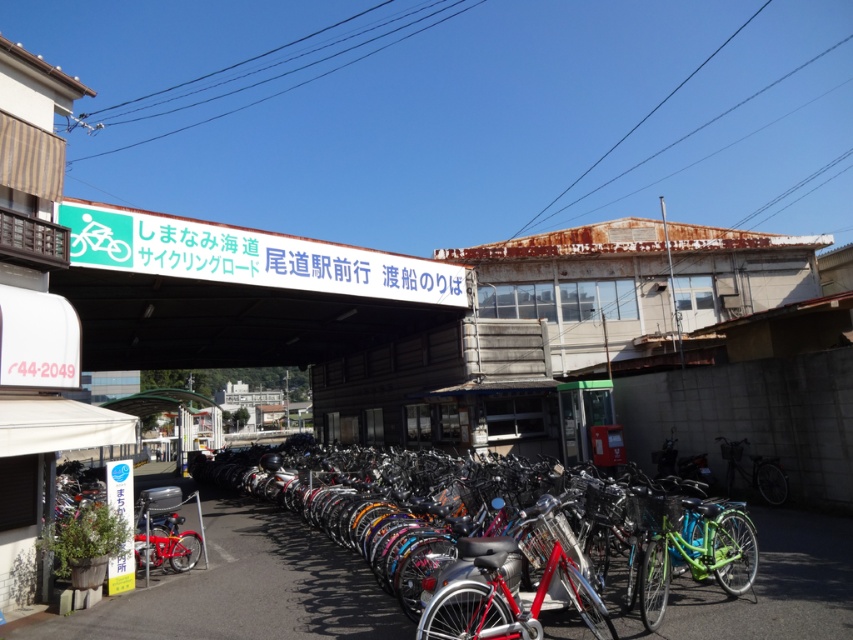
Can you confirm if green signboard at upper center is positioned to the left of shiny red bicycle at center?

Yes, green signboard at upper center is to the left of shiny red bicycle at center.

Is green signboard at upper center thinner than shiny red bicycle at center?

No.

Is point (190, 268) positioned after point (163, 534)?

Yes, point (190, 268) is farther from viewer.

Locate an element on the screen. green signboard at upper center is located at coordinates (241, 294).

Is point (144, 512) farther from viewer compared to point (93, 248)?

No, it is in front of (93, 248).

Does point (164, 499) lie behind point (79, 244)?

No, (164, 499) is closer to viewer.

In order to click on shiny red bicycle at center in this screenshot , I will do `click(166, 531)`.

Can you confirm if shiny metallic bicycle at center is positioned above shiny red bicycle at center?

Actually, shiny metallic bicycle at center is below shiny red bicycle at center.

The image size is (853, 640). What are the coordinates of `shiny metallic bicycle at center` in the screenshot? It's located at (428, 538).

Does point (509, 534) come behind point (155, 557)?

No, (509, 534) is closer to viewer.

Where is `shiny metallic bicycle at center`? shiny metallic bicycle at center is located at coordinates (428, 538).